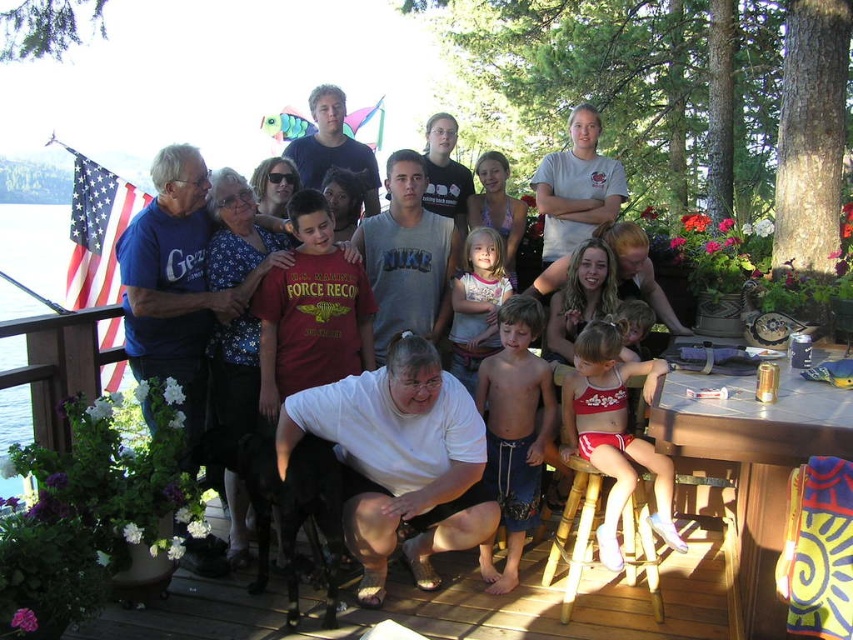
You are a photographer trying to capture a group photo of the people on the wooden deck. You notice the white matte shirt at center and the blue denim shorts at center. Which object is positioned to the left of the other?

The white matte shirt at center is to the left of the blue denim shorts at center according to the description.

You are a photographer trying to capture the perfect group photo. You notice two similar shirts in the center of the group. Which one is positioned to the right of the other? The two shirts are the white cotton shirt at center and the white matte shirt at center. Please specify which one is on the right.

The white cotton shirt at center is positioned to the right of the white matte shirt at center.